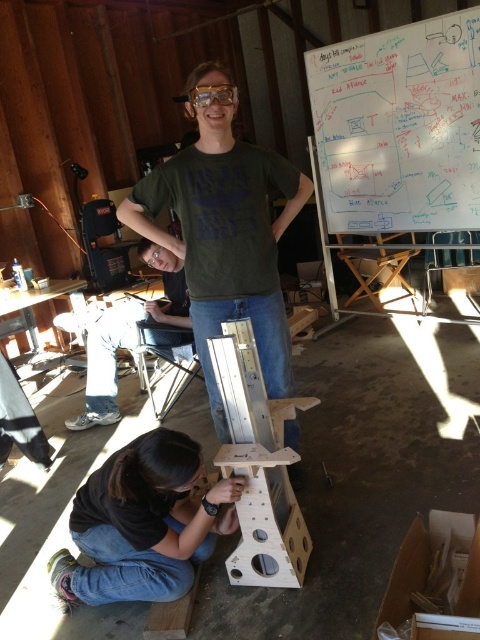
Question: Which point is closer to the camera?

Choices:
 (A) (147, 310)
 (B) (243, 355)
 (C) (113, 502)

Answer: (C)

Question: Which object is positioned farthest from the whiteboard at upper right?

Choices:
 (A) green matte t-shirt at center
 (B) matte black shirt at center
 (C) black matte wood at lower center
 (D) metallic silver easel at center

Answer: (C)

Question: Observing the image, what is the correct spatial positioning of black matte wood at lower center in reference to metallic silver easel at center?

Choices:
 (A) below
 (B) above

Answer: (A)

Question: Does whiteboard at upper right have a lesser width compared to black matte wood at lower center?

Choices:
 (A) yes
 (B) no

Answer: (B)

Question: Among these points, which one is nearest to the camera?

Choices:
 (A) (273, 460)
 (B) (222, 483)
 (C) (264, 362)

Answer: (A)

Question: Does black matte wood at lower center come behind matte black shirt at center?

Choices:
 (A) no
 (B) yes

Answer: (A)